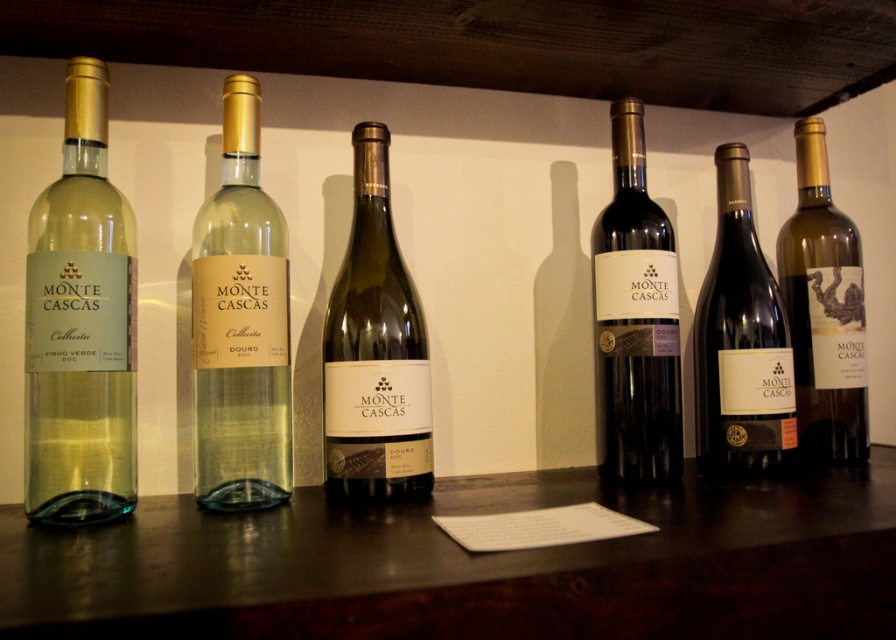
You are organizing a wine tasting event and need to fit a 10cm wide wine rack between the green glass bottle at center and the shiny dark glass bottle at center. Based on the scene description, will the rack fit between them?

The green glass bottle at center is wider than the shiny dark glass bottle at center. However, the question is about the distance between them, not their widths. The provided information does not specify the space between the two bottles, so it cannot be determined if the 10cm rack will fit.

You are a bartender preparing a drink and need to choose between the matte glass bottle at left and the shiny dark glass bottle at center. Which bottle should you pick if you need a taller container to hold more liquid?

The matte glass bottle at left is much taller than the shiny dark glass bottle at center, so you should pick the matte glass bottle at left to hold more liquid.

You are a wine connoisseur examining the bottles. You need to determine which bottle has a wider base for a presentation. Which one should you choose between the matte glass bottle at left and the shiny dark glass bottle at center?

The matte glass bottle at left might be wider than the shiny dark glass bottle at center, so you should choose the matte glass bottle at left for the presentation.